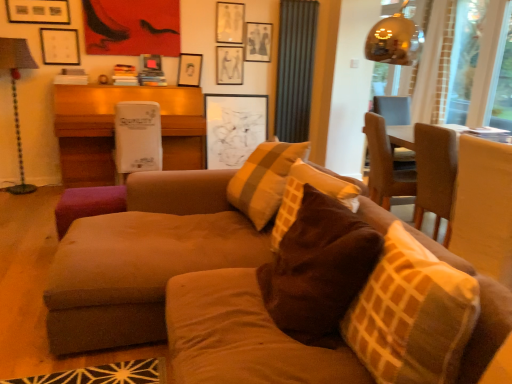
From the picture: How much space does transparent glass window screen at upper right, the 1th window screen from the right, occupy horizontally?

transparent glass window screen at upper right, the 1th window screen from the right, is 1.79 inches wide.

At what (x,y) coordinates should I click in order to perform the action: click on wooden table at right, the 1th table from the right. Please return your answer as a coordinate pair (x, y). The image size is (512, 384). Looking at the image, I should click on (402, 136).

The image size is (512, 384). What do you see at coordinates (229, 65) in the screenshot?
I see `matte white picture frame at upper center, positioned as the 3th picture frame in left-to-right order` at bounding box center [229, 65].

This screenshot has height=384, width=512. What do you see at coordinates (385, 166) in the screenshot?
I see `brown wood chair at right` at bounding box center [385, 166].

The image size is (512, 384). I want to click on beige fabric cushion at right, so click(484, 207).

Is beige fabric cushion at right facing towards white cardboard box at center, the 2th table from the right?

No, beige fabric cushion at right does not turn towards white cardboard box at center, the 2th table from the right.

Is beige fabric cushion at right to the left or to the right of white cardboard box at center, the 1th table positioned from the left, in the image?

beige fabric cushion at right is positioned on white cardboard box at center, the 1th table positioned from the left,'s right side.

Which table is the 2nd one when counting from the back of the beige fabric cushion at right? Please provide its 2D coordinates.

[(113, 129)]

Would you say beige fabric cushion at right is a long distance from white cardboard box at center, the 1th table positioned from the left?

Yes.

Is white cardboard box at center, acting as the 1th table starting from the back, with metallic lampshade at left?

No, white cardboard box at center, acting as the 1th table starting from the back, is not touching metallic lampshade at left.

You are a GUI agent. You are given a task and a screenshot of the screen. Output one action in this format:
    pyautogui.click(x=<x>, y=<y>)
    Task: Click on the table behind the metallic lampshade at left
    This screenshot has height=384, width=512.
    Given the screenshot: What is the action you would take?
    pyautogui.click(x=113, y=129)

In terms of height, does white cardboard box at center, placed as the second table when sorted from front to back, look taller or shorter compared to metallic lampshade at left?

Considering their sizes, white cardboard box at center, placed as the second table when sorted from front to back, has less height than metallic lampshade at left.

Is white cardboard box at center, the 1th table positioned from the left, facing towards metallic lampshade at left?

No, white cardboard box at center, the 1th table positioned from the left, is not aimed at metallic lampshade at left.

From a real-world perspective, is matte black picture frame at upper center, arranged as the second picture frame when viewed from the left, located higher than matte white picture frame at upper center, positioned as the 3th picture frame in right-to-left order?

Incorrect, from a real-world perspective, matte black picture frame at upper center, arranged as the second picture frame when viewed from the left, is lower than matte white picture frame at upper center, positioned as the 3th picture frame in right-to-left order.

From the image's perspective, is matte black picture frame at upper center, arranged as the second picture frame when viewed from the left, above matte white picture frame at upper center, positioned as the 3th picture frame in left-to-right order?

No, from the image's perspective, matte black picture frame at upper center, arranged as the second picture frame when viewed from the left, is not over matte white picture frame at upper center, positioned as the 3th picture frame in left-to-right order.

Are matte black picture frame at upper center, arranged as the second picture frame when viewed from the left, and matte white picture frame at upper center, positioned as the 3th picture frame in right-to-left order, beside each other?

No, matte black picture frame at upper center, arranged as the second picture frame when viewed from the left, is not next to matte white picture frame at upper center, positioned as the 3th picture frame in right-to-left order.

Is matte white picture frame at upper center, positioned as the 3th picture frame in left-to-right order, surrounded by matte black picture frame at upper center, arranged as the second picture frame when viewed from the left?

No, matte white picture frame at upper center, positioned as the 3th picture frame in left-to-right order, is not a part of matte black picture frame at upper center, arranged as the second picture frame when viewed from the left.

Consider the image. Considering the relative positions of white matte picture frame at upper left, the 5th picture frame when ordered from right to left, and dark green fabric curtain at upper center in the image provided, is white matte picture frame at upper left, the 5th picture frame when ordered from right to left, in front of dark green fabric curtain at upper center?

That is True.

Between white matte picture frame at upper left, the 5th picture frame when ordered from right to left, and dark green fabric curtain at upper center, which one has larger size?

dark green fabric curtain at upper center is bigger.

Is white matte picture frame at upper left, the 5th picture frame when ordered from right to left, wider than dark green fabric curtain at upper center?

Incorrect, the width of white matte picture frame at upper left, the 5th picture frame when ordered from right to left, does not surpass that of dark green fabric curtain at upper center.

Which object is positioned more to the right, purple fabric footrest at lower left or brown velvety pillow at center?

From the viewer's perspective, brown velvety pillow at center appears more on the right side.

Who is taller, purple fabric footrest at lower left or brown velvety pillow at center?

brown velvety pillow at center is taller.

Consider the image. Considering the relative sizes of purple fabric footrest at lower left and brown velvety pillow at center in the image provided, is purple fabric footrest at lower left thinner than brown velvety pillow at center?

In fact, purple fabric footrest at lower left might be wider than brown velvety pillow at center.

From a real-world perspective, is purple fabric footrest at lower left above or below brown velvety pillow at center?

purple fabric footrest at lower left is below brown velvety pillow at center.

From the image's perspective, which one is positioned lower, transparent glass window screen at upper right, the 2th window screen positioned from the right, or brown velvety pillow at center?

brown velvety pillow at center appears lower in the image.

Looking at the image, does transparent glass window screen at upper right, the 2th window screen positioned from the right, seem bigger or smaller compared to brown velvety pillow at center?

Considering their sizes, transparent glass window screen at upper right, the 2th window screen positioned from the right, takes up less space than brown velvety pillow at center.

Would you say transparent glass window screen at upper right, the 2th window screen positioned from the right, contains brown velvety pillow at center?

Definitely not — brown velvety pillow at center is not inside transparent glass window screen at upper right, the 2th window screen positioned from the right.

Does transparent glass window screen at upper right, arranged as the 1th window screen when viewed from the left, lie in front of brown velvety pillow at center?

No, transparent glass window screen at upper right, arranged as the 1th window screen when viewed from the left, is further to the viewer.

Is the position of wooden table at right, acting as the first table starting from the front, less distant than that of transparent glass window screen at upper right, marked as the 2th window screen in a left-to-right arrangement?

Yes, it is in front of transparent glass window screen at upper right, marked as the 2th window screen in a left-to-right arrangement.

Which of these two, wooden table at right, the 2th table viewed from the back, or transparent glass window screen at upper right, the 1th window screen from the right, is smaller?

Smaller between the two is transparent glass window screen at upper right, the 1th window screen from the right.

Find the location of a particular element. The width and height of the screenshot is (512, 384). the 2nd table located beneath the transparent glass window screen at upper right, marked as the 2th window screen in a left-to-right arrangement (from a real-world perspective) is located at coordinates (402, 136).

Is wooden table at right, the 1th table from the right, to the left of transparent glass window screen at upper right, the 1th window screen from the right, from the viewer's perspective?

Correct, you'll find wooden table at right, the 1th table from the right, to the left of transparent glass window screen at upper right, the 1th window screen from the right.

The image size is (512, 384). I want to click on table that is the 2nd object located above the beige fabric cushion at right (from the image's perspective), so click(x=113, y=129).

Find the location of a particular element. The width and height of the screenshot is (512, 384). the 1st table directly beneath the metallic lampshade at left (from a real-world perspective) is located at coordinates (113, 129).

When comparing their distances from transparent glass window screen at upper right, the 2th window screen positioned from the right, does white matte picture frame at upper left, the 5th picture frame when ordered from right to left, or dark green fabric curtain at upper center seem further?

white matte picture frame at upper left, the 5th picture frame when ordered from right to left.

Based on their spatial positions, is matte black picture frame at upper center, acting as the fourth picture frame starting from the right, or brown textured pillow at center closer to matte black picture frame at upper center, which ranks as the first picture frame in right-to-left order?

Based on the image, matte black picture frame at upper center, acting as the fourth picture frame starting from the right, appears to be nearer to matte black picture frame at upper center, which ranks as the first picture frame in right-to-left order.

Based on their spatial positions, is transparent glass window screen at upper right, marked as the 2th window screen in a left-to-right arrangement, or matte black picture frame at upper center, which ranks as the first picture frame in right-to-left order, closer to metallic lampshade at left?

The object closer to metallic lampshade at left is matte black picture frame at upper center, which ranks as the first picture frame in right-to-left order.

Based on their spatial positions, is matte black picture frame at upper center, acting as the fourth picture frame starting from the right, or brown wood chair at right closer to white matte picture frame at upper left, the 1th picture frame viewed from the left?

The object closer to white matte picture frame at upper left, the 1th picture frame viewed from the left, is matte black picture frame at upper center, acting as the fourth picture frame starting from the right.

From the picture: Looking at the image, which one is located closer to transparent glass window screen at upper right, arranged as the 1th window screen when viewed from the left, brown wood chair at right or beige fabric cushion at right?

brown wood chair at right is closer to transparent glass window screen at upper right, arranged as the 1th window screen when viewed from the left.

When comparing their distances from purple fabric footrest at lower left, does matte white picture frame at upper center, positioned as the 3th picture frame in right-to-left order, or transparent glass window screen at upper right, arranged as the 1th window screen when viewed from the left, seem closer?

Based on the image, matte white picture frame at upper center, positioned as the 3th picture frame in right-to-left order, appears to be nearer to purple fabric footrest at lower left.

Estimate the real-world distances between objects in this image. Which object is closer to purple fabric footrest at lower left, dark green fabric curtain at upper center or matte black picture frame at upper center, which ranks as the first picture frame in right-to-left order?

Among the two, matte black picture frame at upper center, which ranks as the first picture frame in right-to-left order, is located nearer to purple fabric footrest at lower left.

When comparing their distances from transparent glass window screen at upper right, marked as the 2th window screen in a left-to-right arrangement, does matte black picture frame at upper center, which appears as the second picture frame when viewed from the right, or transparent glass window screen at upper right, the 2th window screen positioned from the right, seem further?

The object further to transparent glass window screen at upper right, marked as the 2th window screen in a left-to-right arrangement, is matte black picture frame at upper center, which appears as the second picture frame when viewed from the right.

This screenshot has height=384, width=512. I want to click on footrest between brown velvety pillow at center and dark green fabric curtain at upper center from front to back, so click(x=88, y=204).

I want to click on footrest between suede couch at center and dark green fabric curtain at upper center from front to back, so click(x=88, y=204).

Image resolution: width=512 pixels, height=384 pixels. I want to click on beige between brown velvety pillow at center and matte white picture frame at upper center, positioned as the 3th picture frame in left-to-right order, from front to back, so click(484, 207).

This screenshot has height=384, width=512. I want to click on beige between brown textured pillow at center and transparent glass window screen at upper right, arranged as the 1th window screen when viewed from the left, from front to back, so click(484, 207).